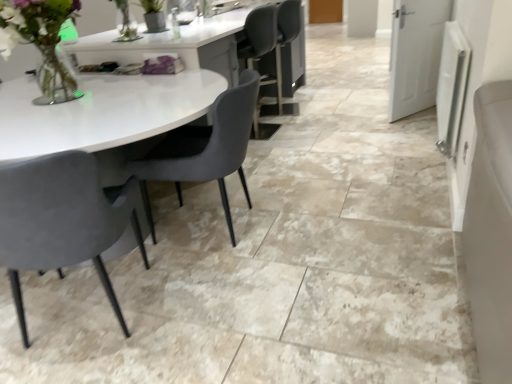
Identify the location of free spot below velvet grey chair at center, the 2th chair in the left-to-right sequence (from a real-world perspective). This screenshot has height=384, width=512. (x=223, y=220).